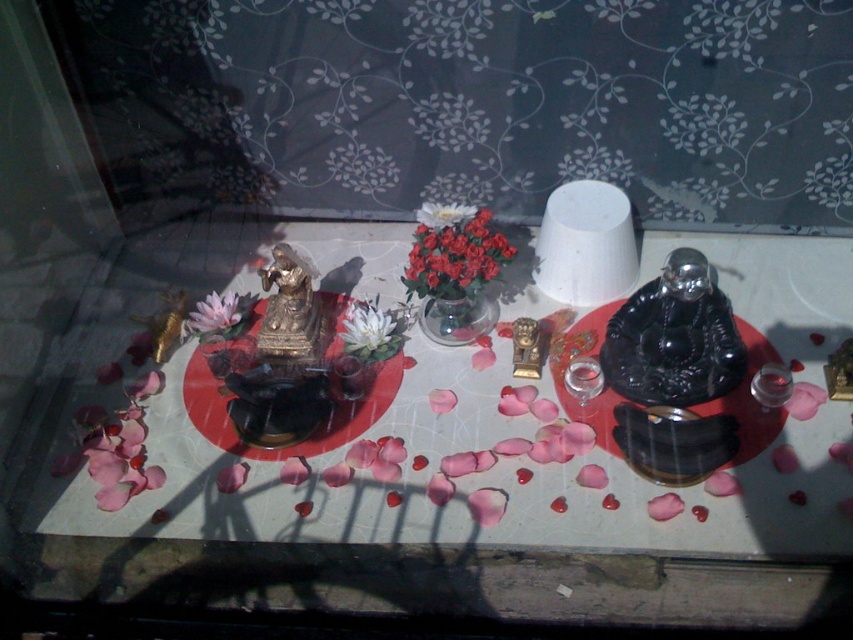
You are standing in front of a shrine on a windowsill with a floral curtain behind it. You see a golden statue on the left and a clear glass at point (453,252). What color are the flowers located at the clear glass?

The flowers at the clear glass are red.

You are standing in front of the altar and want to place a small offering into the clear glass. The offering requires you to be exactly 4 feet away from the white matte flower at center. Can you determine if you are at the correct distance?

The white matte flower at center and viewer are 3.82 feet apart from each other, so you are slightly closer than the required 4 feet. You need to move back approximately 0.18 feet to be at the correct distance.

You are an altar caretaker who needs to place a new offering. You have a small candle that must be placed between the red matte flowers at center and the white matte flower at center. Where should you place the candle to ensure it is between them?

The red matte flowers at center is positioned on the right side of white matte flower at center, so place the candle between them by positioning it to the right of the white matte flower at center and to the left of the red matte flowers at center.